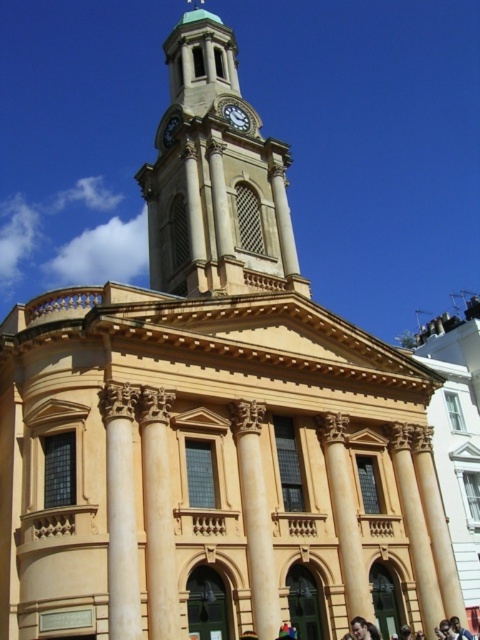
Question: Is smooth beige clock tower at upper center positioned before multicolored striped shirt at lower center?

Choices:
 (A) yes
 (B) no

Answer: (B)

Question: Does smooth beige clock tower at upper center have a smaller size compared to multicolored striped shirt at lower center?

Choices:
 (A) no
 (B) yes

Answer: (A)

Question: Which of the following is the closest to the observer?

Choices:
 (A) beige stone column at center
 (B) smooth skin face at center
 (C) smooth beige clock tower at upper center
 (D) gold metallic clock at upper center

Answer: (B)

Question: Based on their relative distances, which object is farther from the beige stone column at center?

Choices:
 (A) smooth skin face at center
 (B) smooth beige clock tower at upper center
 (C) gold metallic clock at upper center

Answer: (C)

Question: Can you confirm if gold metallic clock at upper center is thinner than multicolored striped shirt at lower center?

Choices:
 (A) yes
 (B) no

Answer: (B)

Question: Based on their relative distances, which object is nearer to the gold metallic clock at upper center?

Choices:
 (A) smooth skin face at center
 (B) multicolored striped shirt at lower center

Answer: (A)